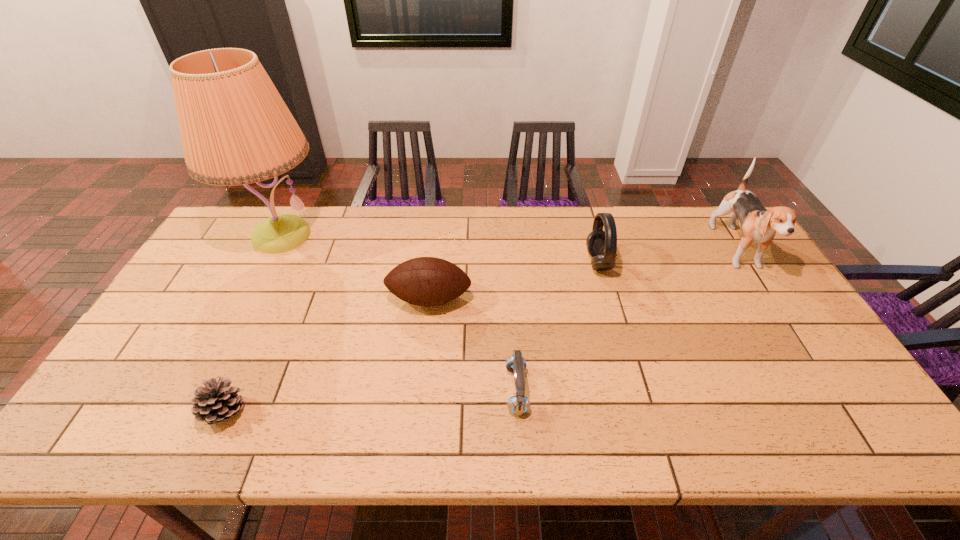
Image resolution: width=960 pixels, height=540 pixels. Identify the location of free location located 0.110m on the side of the lamp near the pull switch. click(x=251, y=294).

The height and width of the screenshot is (540, 960). Find the location of `blank area located 0.180m at the face of the puppy`. blank area located 0.180m at the face of the puppy is located at coordinates (790, 333).

Locate an element on the screen. Image resolution: width=960 pixels, height=540 pixels. vacant area situated on the earcups of the taller headset is located at coordinates (499, 263).

Identify the location of free space located on the earcups of the taller headset. (571, 263).

The width and height of the screenshot is (960, 540). I want to click on free space located on the earcups of the taller headset, so click(x=571, y=263).

Where is `vacant space located 0.100m on the laces of the football`? This screenshot has width=960, height=540. vacant space located 0.100m on the laces of the football is located at coordinates (424, 346).

Identify the location of vacant point located 0.380m on the right of the pinecone. The image size is (960, 540). (408, 413).

This screenshot has height=540, width=960. Identify the location of blank space located on the ear cups of the left headset. tap(444, 390).

Identify the location of free space located 0.150m on the ear cups of the left headset. The image size is (960, 540). (444, 390).

The image size is (960, 540). I want to click on vacant space located on the ear cups of the left headset, so click(x=354, y=390).